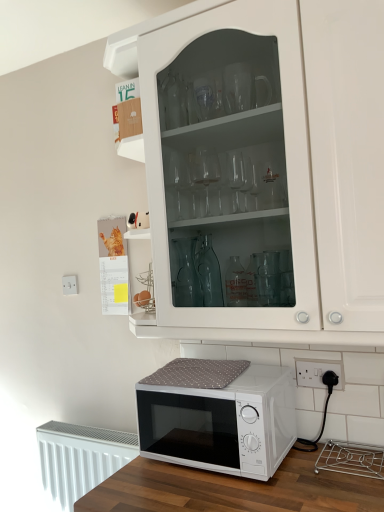
Question: Is white glass cabinet at upper center facing towards white textured radiator at lower left?

Choices:
 (A) yes
 (B) no

Answer: (B)

Question: Could white textured radiator at lower left be considered to be inside white glass cabinet at upper center?

Choices:
 (A) yes
 (B) no

Answer: (B)

Question: Is white glass cabinet at upper center positioned with its back to white textured radiator at lower left?

Choices:
 (A) no
 (B) yes

Answer: (A)

Question: Is white glass cabinet at upper center further to the viewer compared to white textured radiator at lower left?

Choices:
 (A) yes
 (B) no

Answer: (B)

Question: From the image's perspective, does white glass cabinet at upper center appear lower than white textured radiator at lower left?

Choices:
 (A) no
 (B) yes

Answer: (A)

Question: From a real-world perspective, is white glass cabinet at upper center over white textured radiator at lower left?

Choices:
 (A) yes
 (B) no

Answer: (A)

Question: Is white textured radiator at lower left smaller than white plastic electric outlet at lower right, which appears as the 1th electric outlet when viewed from the right?

Choices:
 (A) yes
 (B) no

Answer: (B)

Question: Does white textured radiator at lower left come behind white plastic electric outlet at lower right, the 1th electric outlet when ordered from front to back?

Choices:
 (A) yes
 (B) no

Answer: (A)

Question: Is white textured radiator at lower left at the left side of white plastic electric outlet at lower right, the second electric outlet in the back-to-front sequence?

Choices:
 (A) no
 (B) yes

Answer: (B)

Question: Is white plastic electric outlet at lower right, the second electric outlet in the back-to-front sequence, a part of white textured radiator at lower left?

Choices:
 (A) yes
 (B) no

Answer: (B)

Question: Is white textured radiator at lower left beside white plastic electric outlet at lower right, the 1th electric outlet when ordered from front to back?

Choices:
 (A) yes
 (B) no

Answer: (B)

Question: Is white textured radiator at lower left completely or partially outside of white plastic electric outlet at lower right, the 1th electric outlet when ordered from front to back?

Choices:
 (A) no
 (B) yes

Answer: (B)

Question: From a real-world perspective, is white plastic electric outlet at lower right, which appears as the 1th electric outlet when viewed from the right, on top of white glass cabinet at upper center?

Choices:
 (A) no
 (B) yes

Answer: (A)